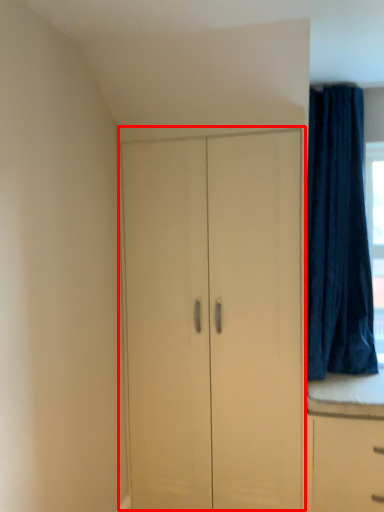
Question: From the image, what is the correct spatial relationship of cupboard (annotated by the red box) in relation to curtain?

Choices:
 (A) right
 (B) left

Answer: (B)